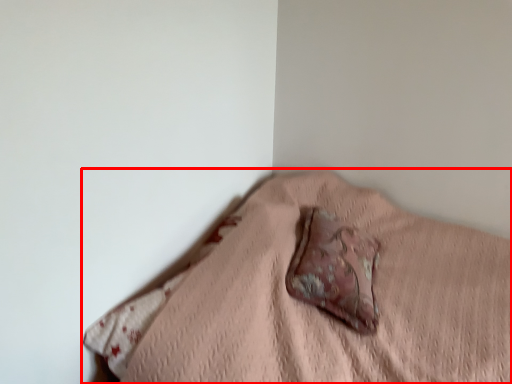
Question: Observing the image, what is the correct spatial positioning of furniture (annotated by the red box) in reference to throw pillow?

Choices:
 (A) left
 (B) right

Answer: (B)